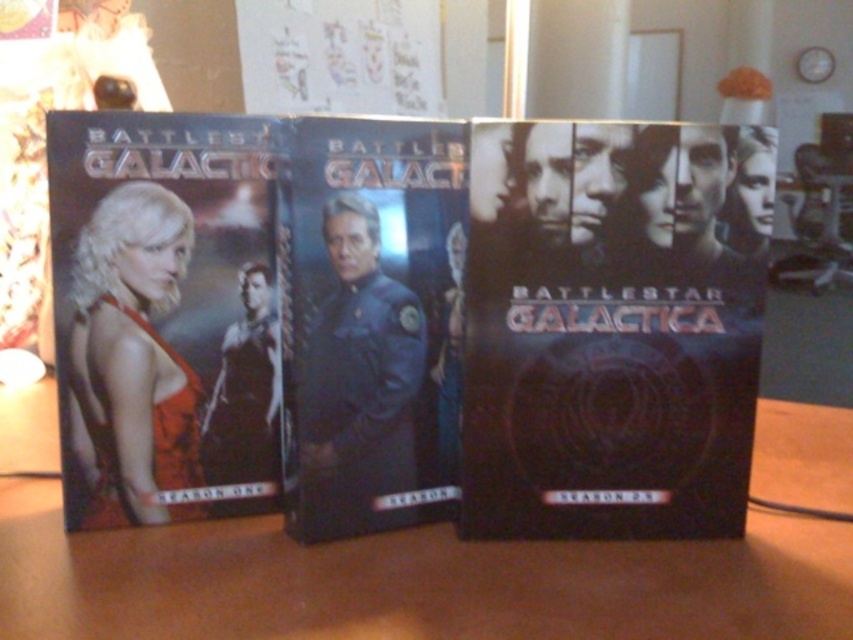
You are a drone trying to pick up the DVD case with the point at coordinates point [169,545] and point [398,378]. Which point is closer to you so you can grab it first?

Point [169,545] is closer to the camera than point [398,378], so you should grab point [169,545] first.

You are organizing DVDs on a wooden table and need to ensure there is enough space between the black matte DVD at center and the edge of the wooden table at center. If the table is 12 inches wide, can the DVD fit without touching the edge?

The black matte dvd at center is 5.93 inches from the wooden table at center. Since the table is 12 inches wide, the DVD can fit without touching the edge as there is sufficient space.